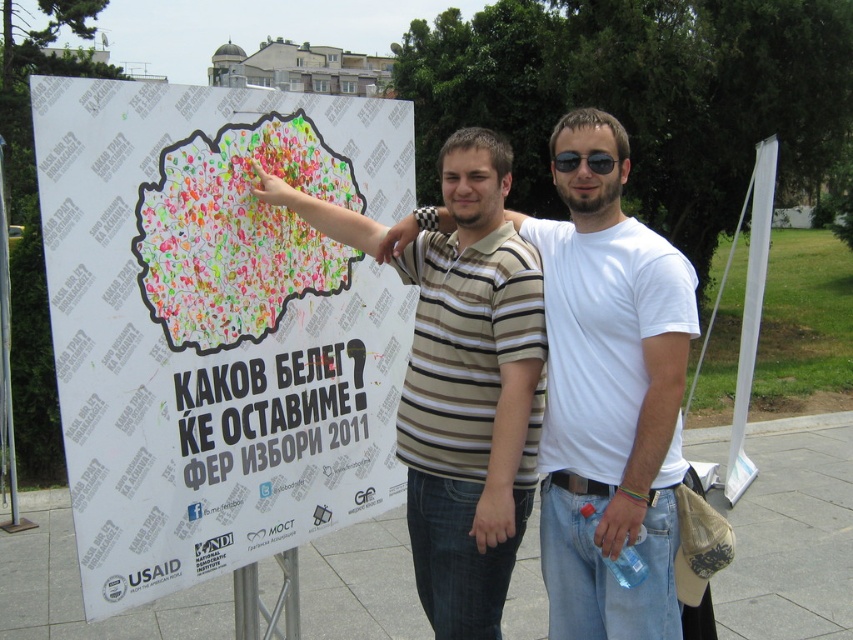
Where is `white paper poster at left`? white paper poster at left is located at coordinates (216, 323).

Is white paper poster at left positioned behind sunglasses at center?

No, it is not.

Identify the location of white paper poster at left. (216, 323).

Who is positioned more to the right, white paper poster at left or brown striped polo shirt at center?

brown striped polo shirt at center

Which of these two, white paper poster at left or brown striped polo shirt at center, stands shorter?

With less height is white paper poster at left.

Between point (138, 593) and point (281, 200), which one is positioned behind?

Positioned behind is point (281, 200).

At what (x,y) coordinates should I click in order to perform the action: click on white paper poster at left. Please return your answer as a coordinate pair (x, y). The height and width of the screenshot is (640, 853). Looking at the image, I should click on (216, 323).

Can you confirm if brown striped polo shirt at center is shorter than sunglasses at center?

In fact, brown striped polo shirt at center may be taller than sunglasses at center.

How far apart are brown striped polo shirt at center and sunglasses at center?

brown striped polo shirt at center is 21.68 inches away from sunglasses at center.

This screenshot has height=640, width=853. In order to click on brown striped polo shirt at center in this screenshot , I will do `click(608, 394)`.